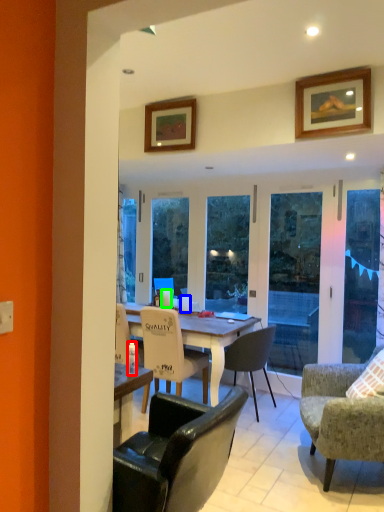
Question: Which object is the closest to the bottle (highlighted by a red box)? Choose among these: coffee cup (highlighted by a blue box) or coffee cup (highlighted by a green box).

Choices:
 (A) coffee cup
 (B) coffee cup

Answer: (A)